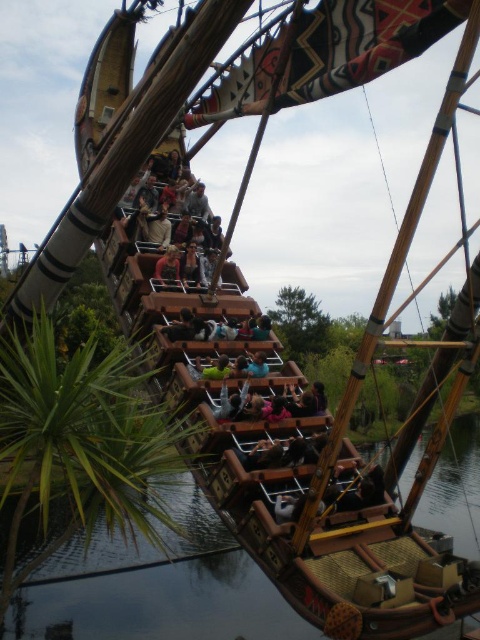
Question: Is transparent water at lower center behind light brown wood at center?

Choices:
 (A) no
 (B) yes

Answer: (A)

Question: Based on their relative distances, which object is farther from the light brown wood at center?

Choices:
 (A) transparent water at lower center
 (B) wooden plank at center

Answer: (A)

Question: Does transparent water at lower center lie in front of light brown wood at center?

Choices:
 (A) yes
 (B) no

Answer: (A)

Question: Is transparent water at lower center wider than wooden plank at center?

Choices:
 (A) no
 (B) yes

Answer: (B)

Question: Estimate the real-world distances between objects in this image. Which object is farther from the wooden plank at center?

Choices:
 (A) transparent water at lower center
 (B) light brown wood at center

Answer: (A)

Question: Which object is positioned farthest from the light brown wood at center?

Choices:
 (A) transparent water at lower center
 (B) wooden plank at center

Answer: (A)